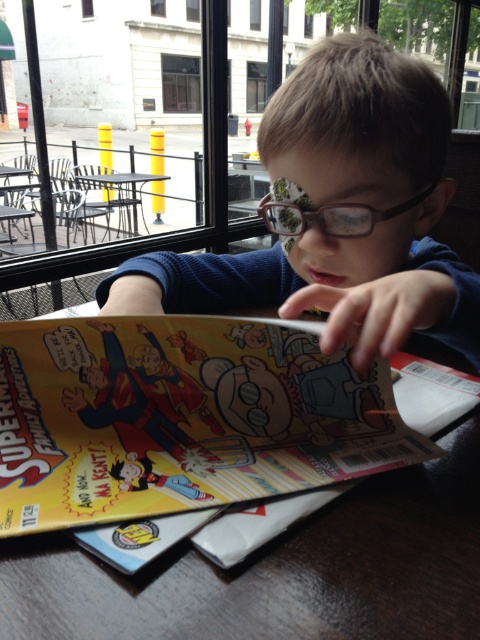
Question: Is brown matte glasses at center thinner than metallic gray table at center?

Choices:
 (A) yes
 (B) no

Answer: (A)

Question: Can you confirm if brown matte glasses at center is bigger than brown plastic glasses at center?

Choices:
 (A) no
 (B) yes

Answer: (B)

Question: Which object appears closest to the camera in this image?

Choices:
 (A) brown matte glasses at center
 (B) brown plastic glasses at center
 (C) metallic gray table at center

Answer: (A)

Question: Which point is farther to the camera?

Choices:
 (A) (110, 189)
 (B) (367, 221)
 (C) (417, 324)

Answer: (A)

Question: Which point is farther to the camera?

Choices:
 (A) (99, 298)
 (B) (286, 230)
 (C) (101, 180)

Answer: (C)

Question: From the image, what is the correct spatial relationship of brown matte glasses at center in relation to metallic gray table at center?

Choices:
 (A) below
 (B) above

Answer: (A)